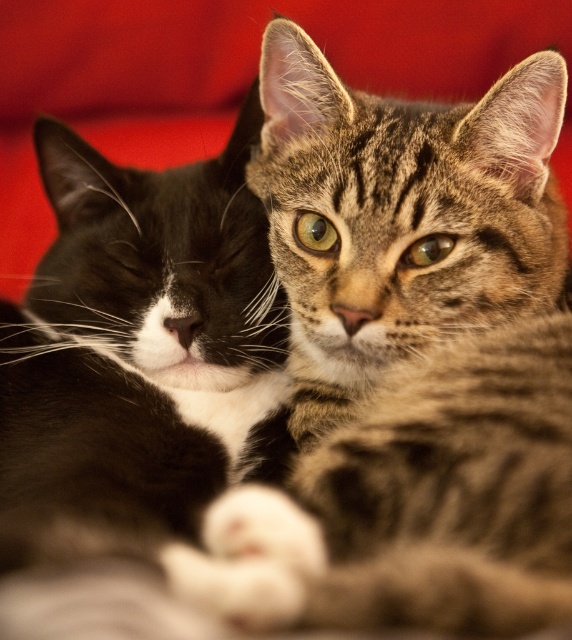
You are a photographer trying to capture a closeup of the tabby fur cat at center and the soft fur cat at center. Which cat should you focus on first to ensure both are in focus?

You should focus on the tabby fur cat at center first because it is closer to you than the soft fur cat at center, so adjusting focus from near to far will help both be in focus.

You are a photographer trying to capture a closeup shot of both cats. Your camera can only focus on objects within a 15 cm range. Given their current positions, can you focus on both the tabby fur cat at center and the soft fur cat at center simultaneously?

The distance between the tabby fur cat at center and the soft fur cat at center is 20.61 centimeters. Since the camera can only focus within a 15 cm range, the distance between them exceeds this limit. Therefore, you cannot focus on both cats simultaneously.

You are a photographer holding a camera that is 30 inches wide. You want to take a photo of the two cats resting against the vibrant red background. If you position your camera so that its left edge aligns with the point marked at coordinates point (407, 556), will the entire camera fit within the frame without overlapping the cats?

The point marked at coordinates point (407, 556) is 30.49 inches away from the viewer. Since the camera is 30 inches wide, positioning it so that its left edge aligns with this point would leave 0.49 inches of space between the right edge of the camera and the cats, allowing the entire camera to fit within the frame without overlapping them.